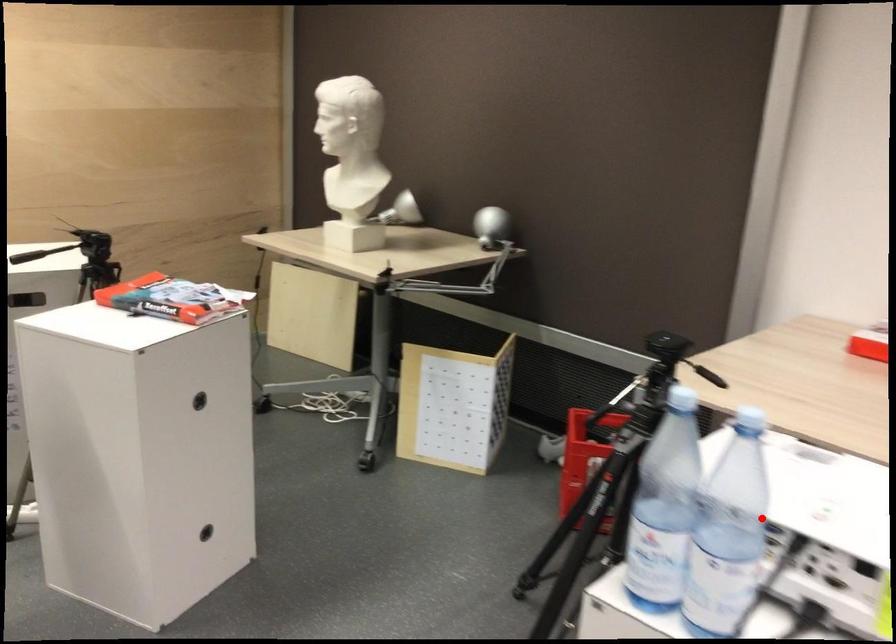
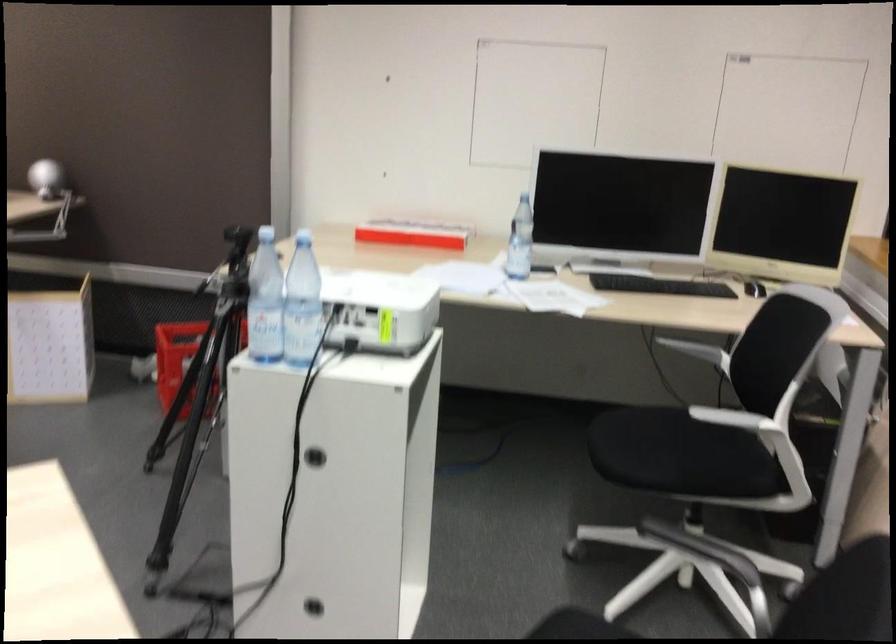
Question: I am providing you with two images of the same scene from different viewpoints. Given a red point in image1, look at the same physical point in image2. Is it:

Choices:
 (A) Closer to the viewpoint
 (B) Farther from the viewpoint

Answer: (B)